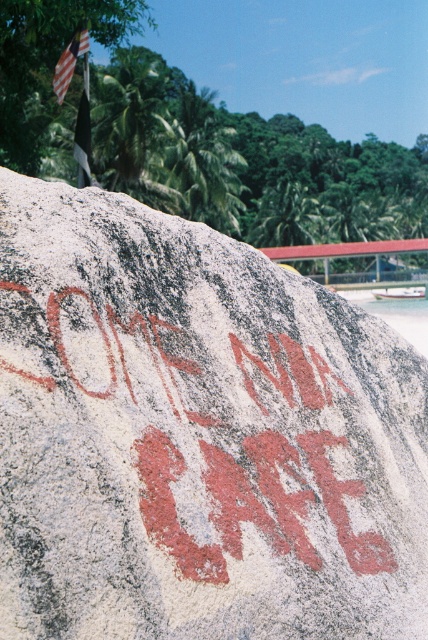
Question: Is reddish-brown stone at center to the left of american flag at upper left from the viewer's perspective?

Choices:
 (A) no
 (B) yes

Answer: (A)

Question: Is the position of reddish-brown stone at center more distant than that of american flag at upper left?

Choices:
 (A) yes
 (B) no

Answer: (B)

Question: Among these points, which one is nearest to the camera?

Choices:
 (A) (68, 68)
 (B) (413, 490)

Answer: (B)

Question: Can you confirm if reddish-brown stone at center is positioned below american flag at upper left?

Choices:
 (A) yes
 (B) no

Answer: (A)

Question: Which point appears closest to the camera in this image?

Choices:
 (A) (65, 76)
 (B) (177, 573)

Answer: (B)